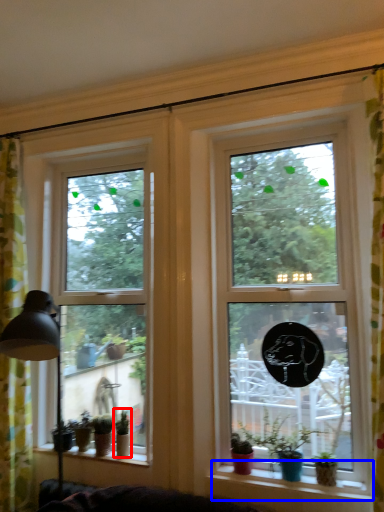
Question: Among these objects, which one is nearest to the camera, houseplant (highlighted by a red box) or window sill (highlighted by a blue box)?

Choices:
 (A) houseplant
 (B) window sill

Answer: (B)